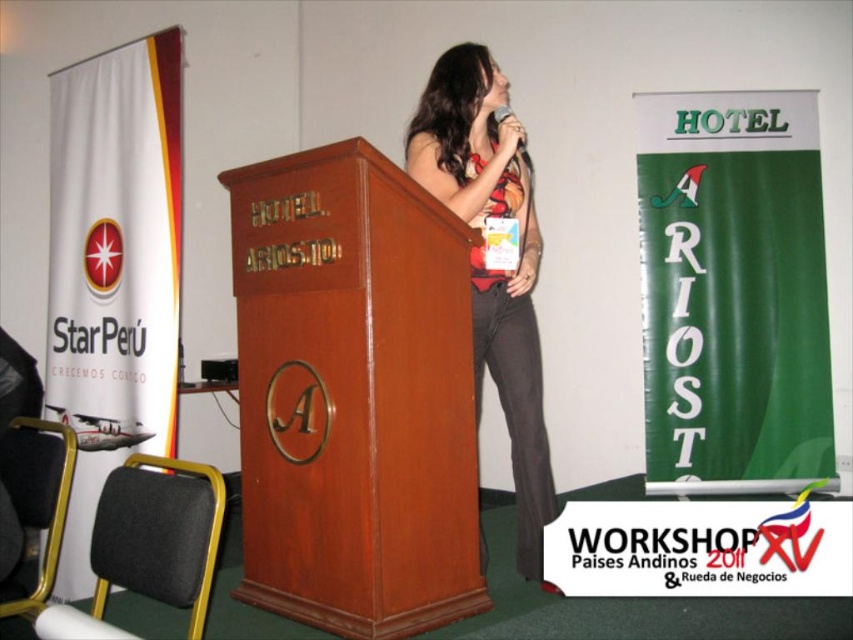
Question: Is mahogany wood podium at center bigger than matte black dress at center?

Choices:
 (A) yes
 (B) no

Answer: (B)

Question: Is mahogany wood podium at center positioned in front of metallic silver microphone at upper center?

Choices:
 (A) yes
 (B) no

Answer: (A)

Question: Which point is closer to the camera?

Choices:
 (A) matte black dress at center
 (B) mahogany wood podium at center

Answer: (B)

Question: Can you confirm if mahogany wood podium at center is bigger than matte black dress at center?

Choices:
 (A) yes
 (B) no

Answer: (B)

Question: Among these points, which one is nearest to the camera?

Choices:
 (A) (259, 460)
 (B) (515, 520)
 (C) (520, 148)

Answer: (A)

Question: Estimate the real-world distances between objects in this image. Which object is closer to the mahogany wood podium at center?

Choices:
 (A) metallic silver microphone at upper center
 (B) matte black dress at center

Answer: (B)